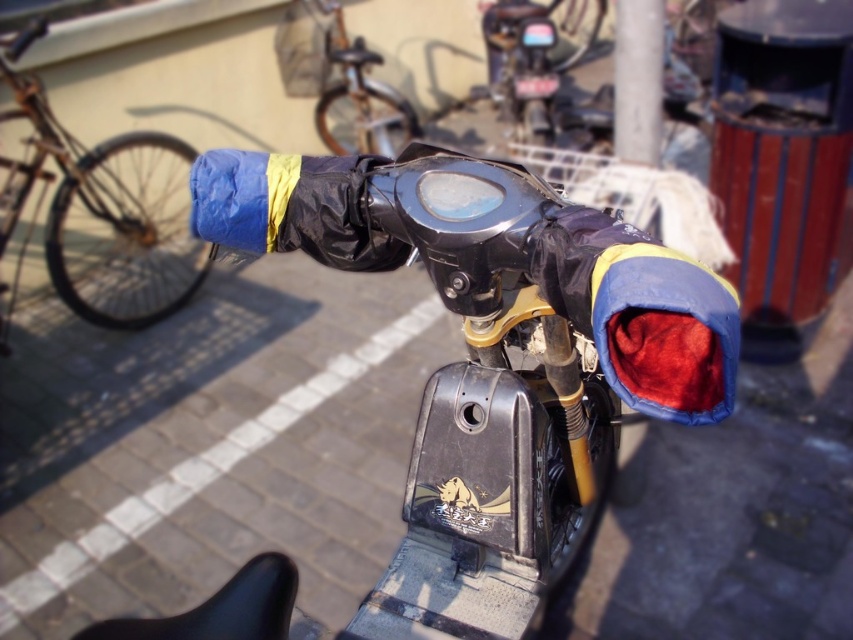
Is blue fabric handlebar cover at center wider than blue fabric handlebar cover at left?

Incorrect, blue fabric handlebar cover at center's width does not surpass blue fabric handlebar cover at left's.

Is point (531, 576) in front of point (24, 244)?

That is True.

What are the coordinates of `blue fabric handlebar cover at center` in the screenshot? It's located at (529, 384).